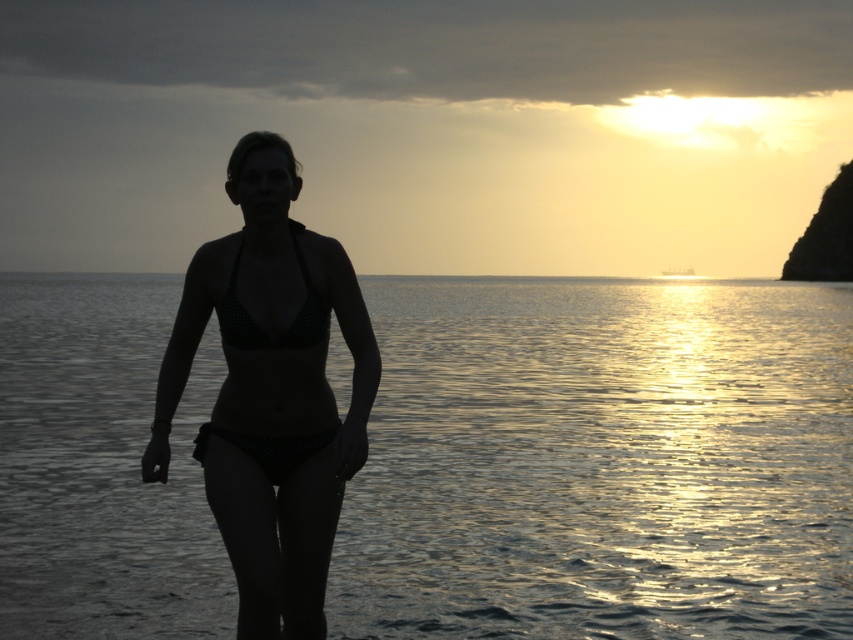
Is glistening water at center positioned behind black dotted bikini at center?

Yes.

Can you confirm if glistening water at center is shorter than black dotted bikini at center?

In fact, glistening water at center may be taller than black dotted bikini at center.

Where is `glistening water at center`? This screenshot has width=853, height=640. glistening water at center is located at coordinates (602, 461).

This screenshot has height=640, width=853. I want to click on glistening water at center, so click(x=602, y=461).

Who is more distant from viewer, (631, 484) or (274, 406)?

Point (631, 484)

Does glistening water at center lie behind black dotted fabric bikini at center?

Yes, glistening water at center is behind black dotted fabric bikini at center.

Is point (485, 470) in front of point (294, 244)?

No, it is behind (294, 244).

You are a GUI agent. You are given a task and a screenshot of the screen. Output one action in this format:
    pyautogui.click(x=<x>, y=<y>)
    Task: Click on the glistening water at center
    
    Given the screenshot: What is the action you would take?
    pyautogui.click(x=602, y=461)

Is point (271, 468) behind point (265, 140)?

Yes, point (271, 468) is farther from viewer.

Based on the photo, can you confirm if black dotted bikini at center is positioned to the left of silhouette bikini at center?

In fact, black dotted bikini at center is to the right of silhouette bikini at center.

Image resolution: width=853 pixels, height=640 pixels. Identify the location of black dotted bikini at center. (271, 392).

Where is `black dotted bikini at center`? This screenshot has height=640, width=853. black dotted bikini at center is located at coordinates (x=271, y=392).